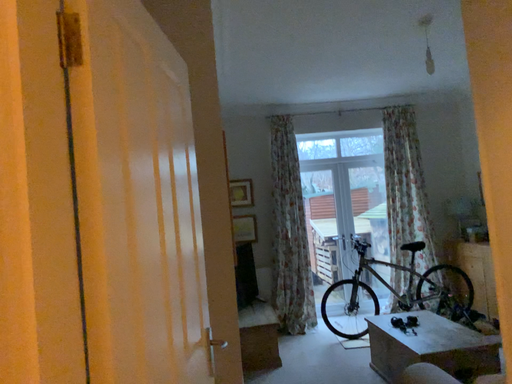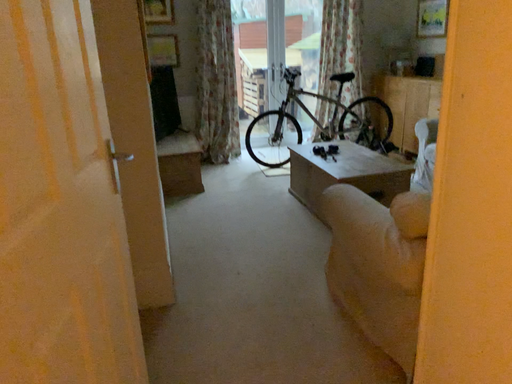
Question: How did the camera likely rotate when shooting the video?

Choices:
 (A) rotated right
 (B) rotated left

Answer: (A)